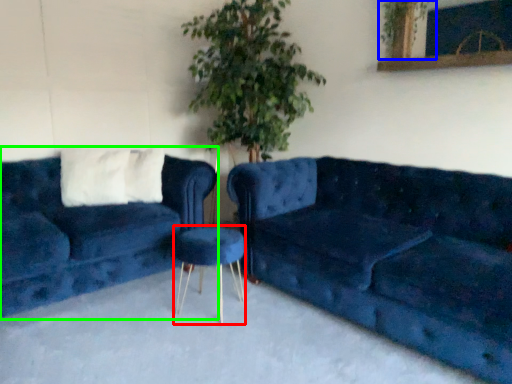
Question: Which object is the closest to the bar stool (highlighted by a red box)? Choose among these: plant (highlighted by a blue box) or studio couch (highlighted by a green box).

Choices:
 (A) plant
 (B) studio couch

Answer: (B)